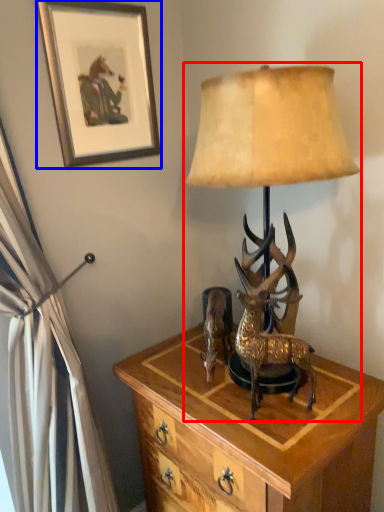
Question: Which object appears closest to the camera in this image, lamp (highlighted by a red box) or picture frame (highlighted by a blue box)?

Choices:
 (A) lamp
 (B) picture frame

Answer: (A)